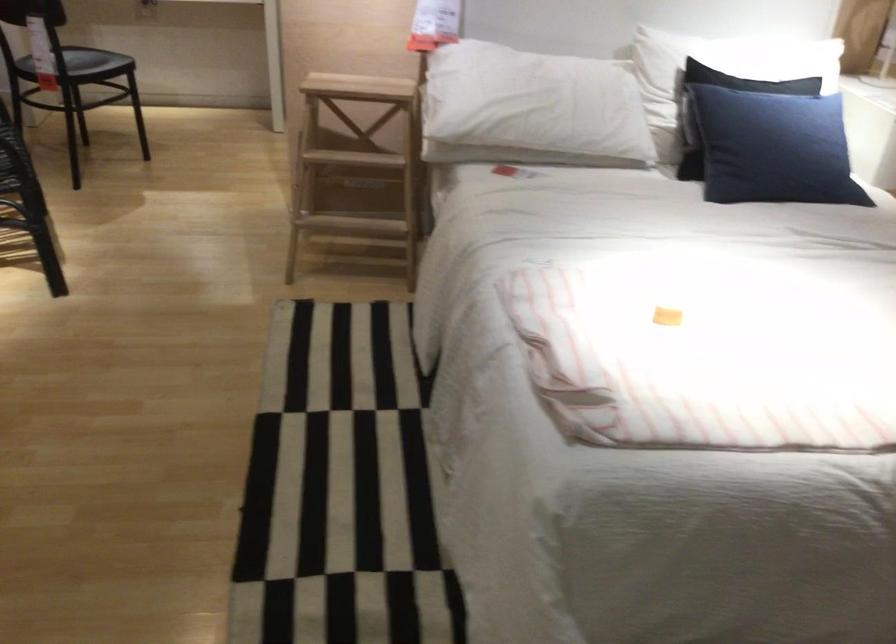
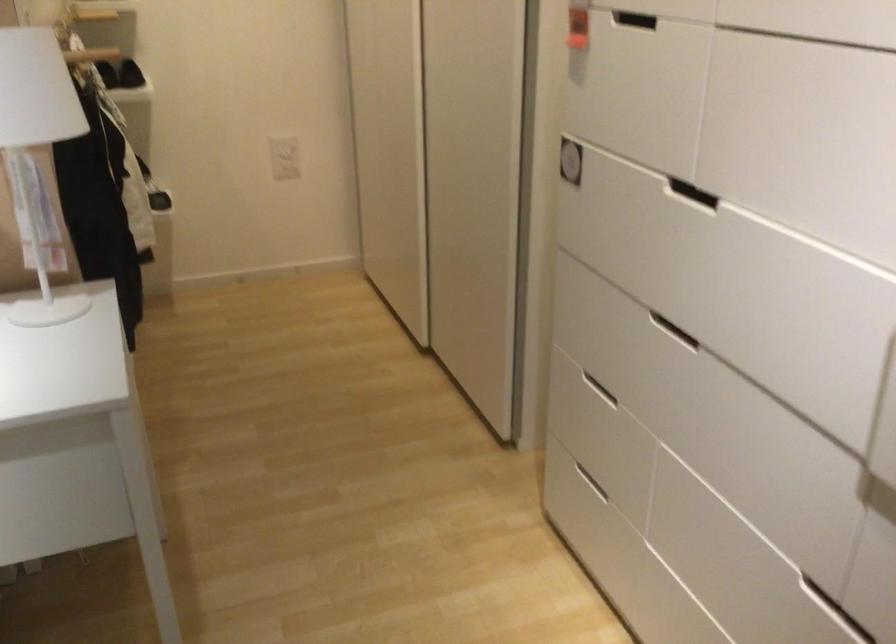
The images are taken continuously from a first-person perspective. In which direction are you moving?

The cameraman walked toward right, forward.